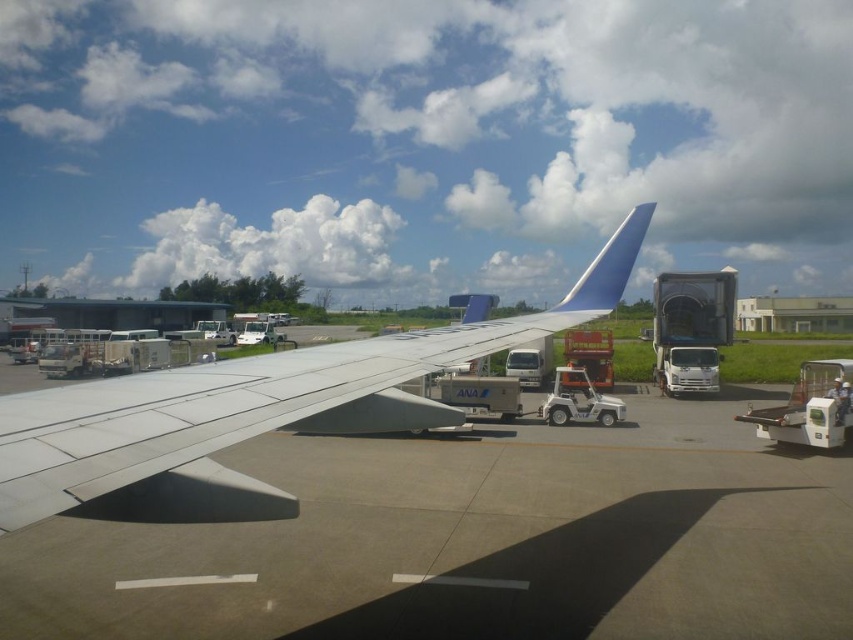
What object is located at the coordinates point (252, 410) in the image?

The point (252, 410) marks the white matte airplane wing at center.

Please provide the coordinates of the white matte airplane wing at center in the image.

The white matte airplane wing at center is located at point coordinates of (252, 410).